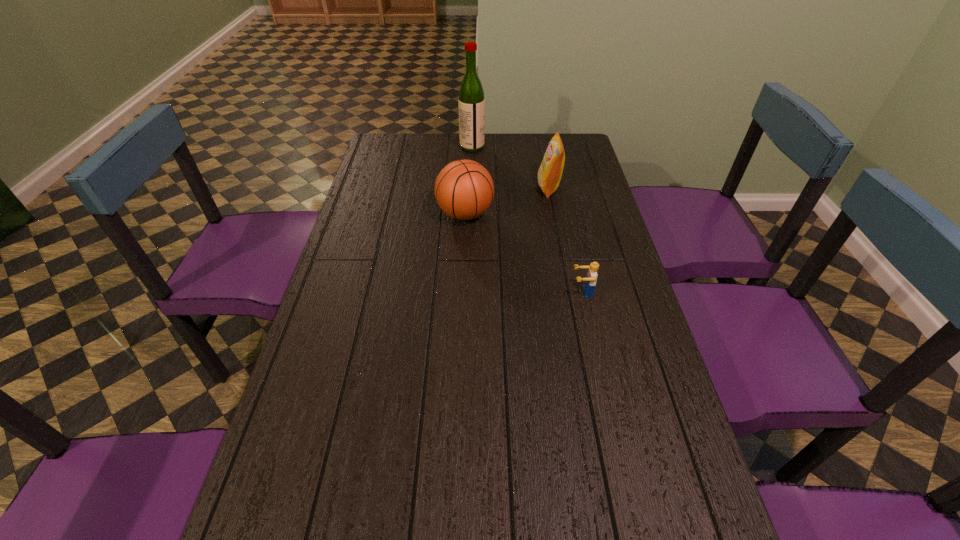
Identify the location of free point at the far left corner. (402, 157).

This screenshot has width=960, height=540. I want to click on vacant region at the far right corner of the desktop, so click(x=574, y=148).

The width and height of the screenshot is (960, 540). I want to click on free space between the basketball and the nearest object, so click(x=523, y=253).

This screenshot has height=540, width=960. In order to click on empty space that is in between the Lego and the basketball in this screenshot , I will do `click(523, 253)`.

This screenshot has width=960, height=540. I want to click on free space between the basketball and the crisp (potato chip), so click(507, 201).

Locate an element on the screen. The height and width of the screenshot is (540, 960). free area in between the shortest object and the basketball is located at coordinates (523, 253).

I want to click on the closest object to the crisp (potato chip), so click(464, 189).

Image resolution: width=960 pixels, height=540 pixels. In order to click on object that is the second nearest to the farthest object in this screenshot , I will do `click(464, 189)`.